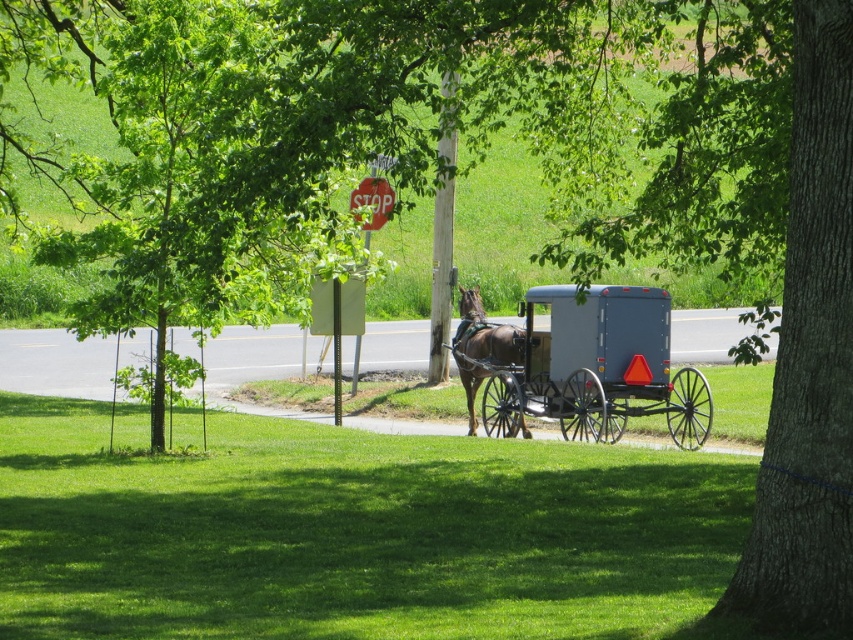
Question: Considering the relative positions of matte gray wagon at center and brown glossy horse at center in the image provided, where is matte gray wagon at center located with respect to brown glossy horse at center?

Choices:
 (A) below
 (B) above

Answer: (A)

Question: Does matte gray wagon at center have a smaller size compared to brown glossy horse at center?

Choices:
 (A) yes
 (B) no

Answer: (B)

Question: In this image, where is matte gray wagon at center located relative to brown glossy horse at center?

Choices:
 (A) above
 (B) below

Answer: (B)

Question: Which point is farther to the camera?

Choices:
 (A) (479, 376)
 (B) (660, 300)

Answer: (A)